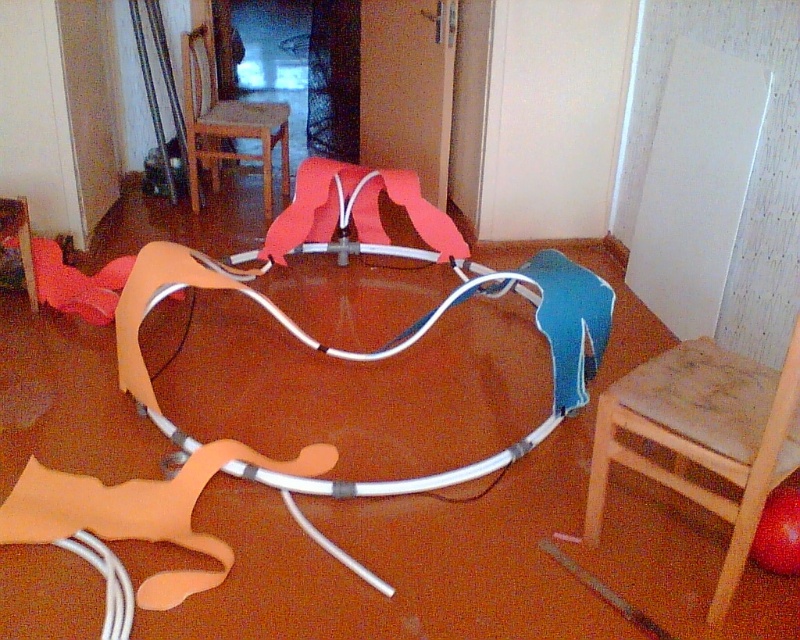
You are standing in the room and see the metallic silver hula hoop at center. What is the color of the object located at point (384, 348)?

The object at point (384, 348) is the metallic silver hula hoop at center.

You are standing in the room and want to move from the wooden stool at lower right to the wooden chair at upper center. Which direction should you move to reach the chair?

To reach the wooden chair at upper center from the wooden stool at lower right, you should move upward since the wooden stool at lower right is below the wooden chair at upper center.